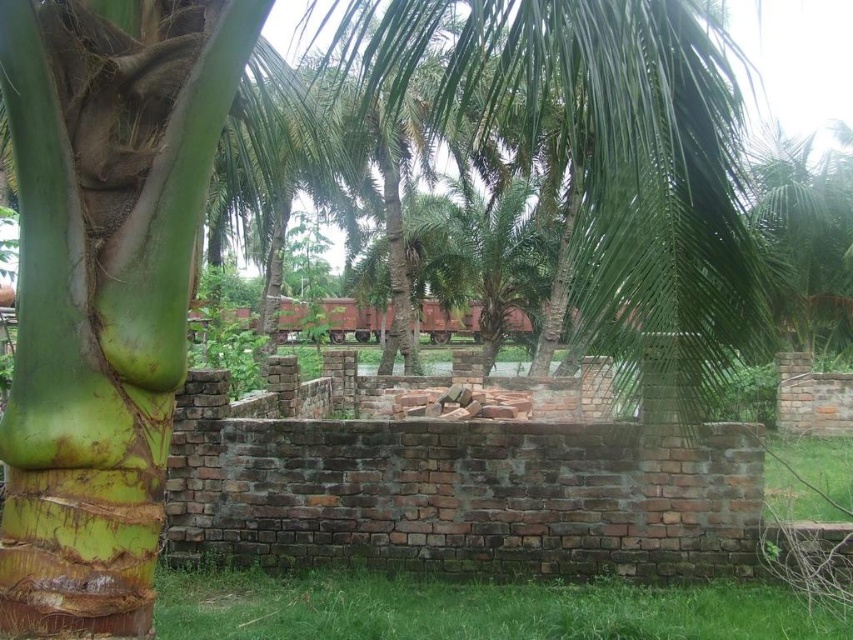
Question: Is green grass at lower center bigger than green leafy palm tree at center?

Choices:
 (A) yes
 (B) no

Answer: (B)

Question: Among these objects, which one is nearest to the camera?

Choices:
 (A) green leafy palm tree at center
 (B) green grass at lower center

Answer: (B)

Question: Which object is closer to the camera taking this photo?

Choices:
 (A) green leafy palm tree at center
 (B) green grass at lower center

Answer: (B)

Question: Does green grass at lower center lie in front of green leafy palm tree at center?

Choices:
 (A) yes
 (B) no

Answer: (A)

Question: Is green grass at lower center behind green leafy palm tree at center?

Choices:
 (A) no
 (B) yes

Answer: (A)